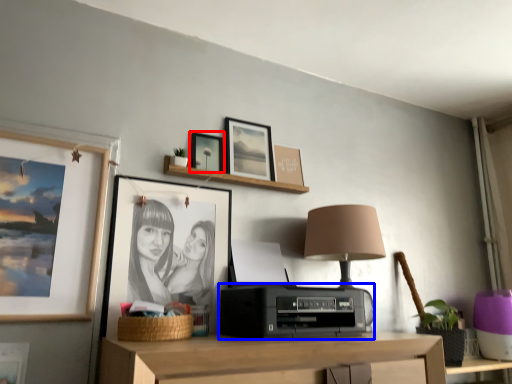
Question: Which object is further to the camera taking this photo, picture frame (highlighted by a red box) or stereo (highlighted by a blue box)?

Choices:
 (A) picture frame
 (B) stereo

Answer: (A)